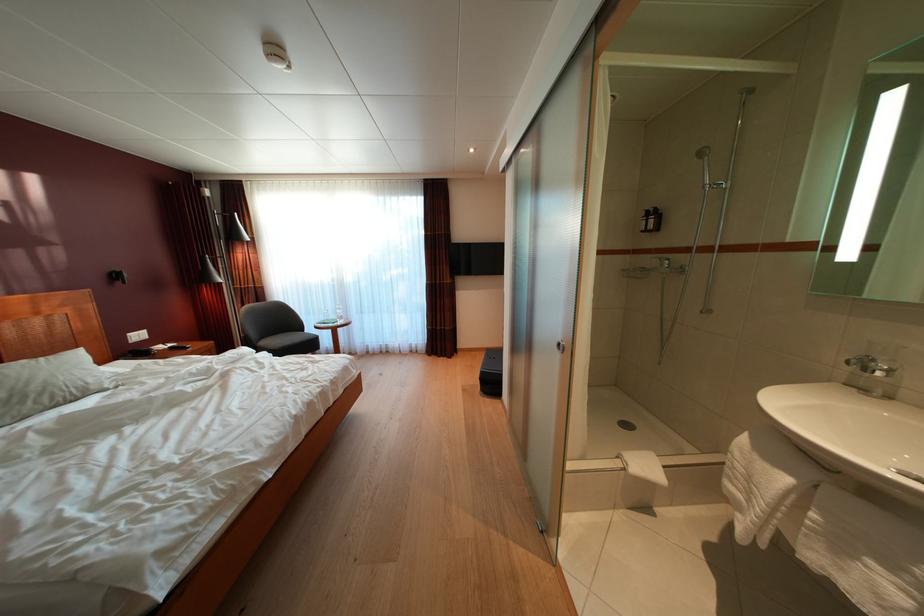
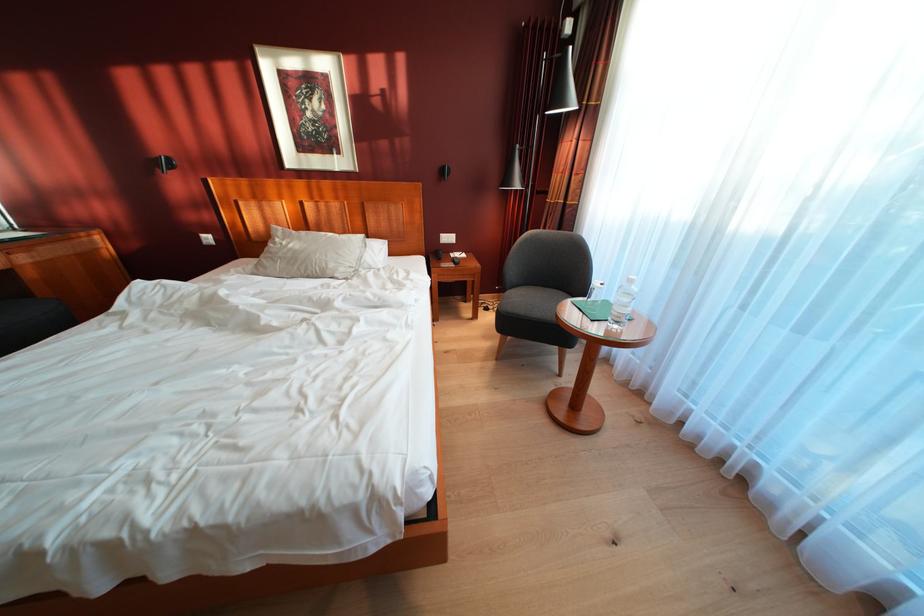
Find the pixel in the second image that matches (102,392) in the first image.

(336, 278)